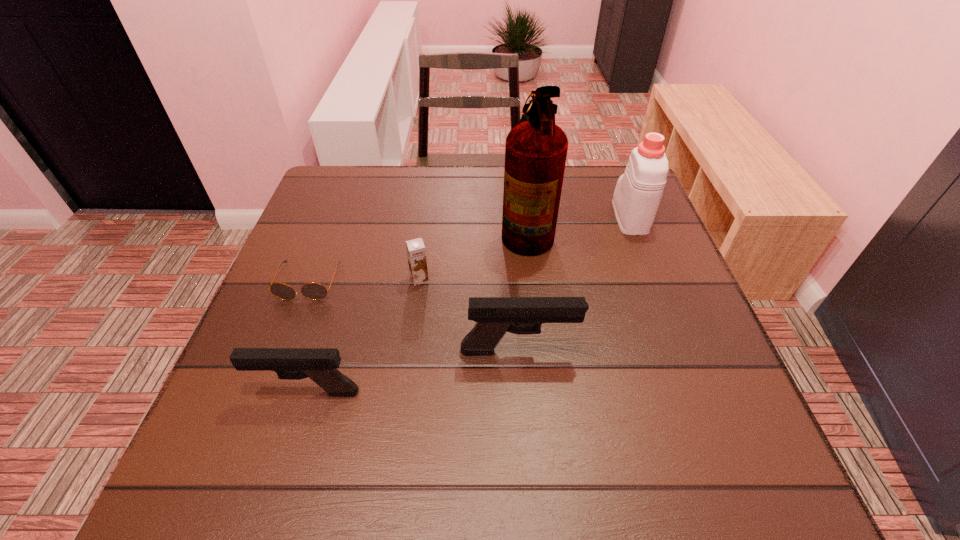
Find the location of a particular element. This screenshot has height=540, width=960. pistol that is at the left edge is located at coordinates (319, 364).

Image resolution: width=960 pixels, height=540 pixels. I want to click on sunglasses positioned at the left edge, so click(x=314, y=291).

Where is `object that is at the right edge`? This screenshot has height=540, width=960. object that is at the right edge is located at coordinates (638, 192).

Find the location of `object positioned at the near left corner`. object positioned at the near left corner is located at coordinates (x=319, y=364).

Find the location of a particular element. The width and height of the screenshot is (960, 540). object that is at the far right corner is located at coordinates (638, 192).

Where is `vacant space at the far edge`? vacant space at the far edge is located at coordinates (432, 198).

I want to click on vacant space at the near edge, so click(x=576, y=388).

Identify the location of vacant area at the left edge of the desktop. (278, 338).

This screenshot has height=540, width=960. In the image, there is a desktop. Identify the location of vacant space at the right edge. (639, 364).

Locate an element on the screen. vacant area at the far left corner is located at coordinates (333, 207).